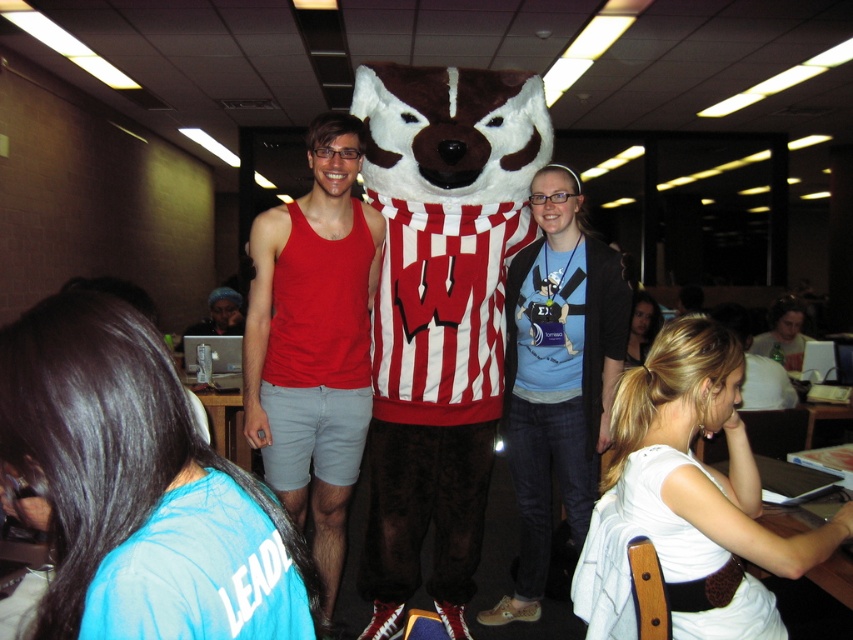
Does white fabric shirt at lower right have a larger size compared to blonde hair at lower right?

Incorrect, white fabric shirt at lower right is not larger than blonde hair at lower right.

Is white fabric shirt at lower right to the left of blonde hair at lower right from the viewer's perspective?

Indeed, white fabric shirt at lower right is positioned on the left side of blonde hair at lower right.

Measure the distance between point (605, 620) and camera.

Point (605, 620) is 1.39 meters away from camera.

I want to click on white fabric shirt at lower right, so click(x=689, y=499).

Does blue fabric shirt at lower left have a smaller size compared to blue cotton t-shirt at center?

Indeed, blue fabric shirt at lower left has a smaller size compared to blue cotton t-shirt at center.

In the scene shown: Who is positioned more to the left, blue fabric shirt at lower left or blue cotton t-shirt at center?

blue fabric shirt at lower left is more to the left.

Is point (238, 554) positioned behind point (614, 272)?

No, (238, 554) is in front of (614, 272).

I want to click on blue fabric shirt at lower left, so click(x=138, y=486).

Does blue cotton t-shirt at center have a lesser width compared to matte black laptop at left?

Indeed, blue cotton t-shirt at center has a lesser width compared to matte black laptop at left.

Who is more forward, (567, 275) or (236, 300)?

Point (567, 275)

Find the location of a particular element. This screenshot has height=640, width=853. blue cotton t-shirt at center is located at coordinates (556, 376).